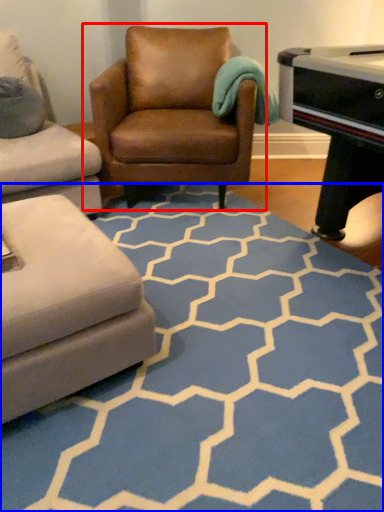
Question: Which point is further to the camera, chair (highlighted by a red box) or pattern (highlighted by a blue box)?

Choices:
 (A) chair
 (B) pattern

Answer: (A)